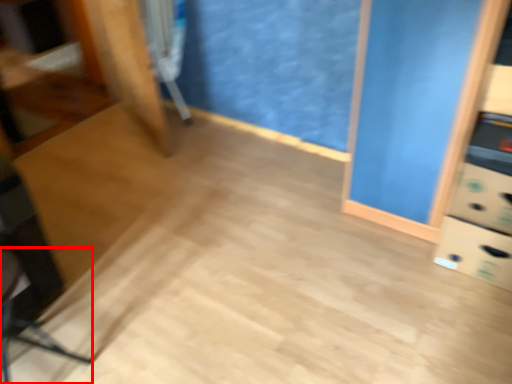
Question: From the image, what is the correct spatial relationship of swivel chair (annotated by the red box) in relation to swivel chair?

Choices:
 (A) left
 (B) right

Answer: (A)